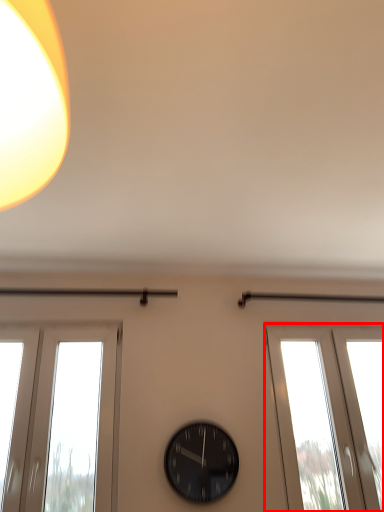
Question: From the image's perspective, where is window (annotated by the red box) located relative to wall clock?

Choices:
 (A) above
 (B) below

Answer: (A)